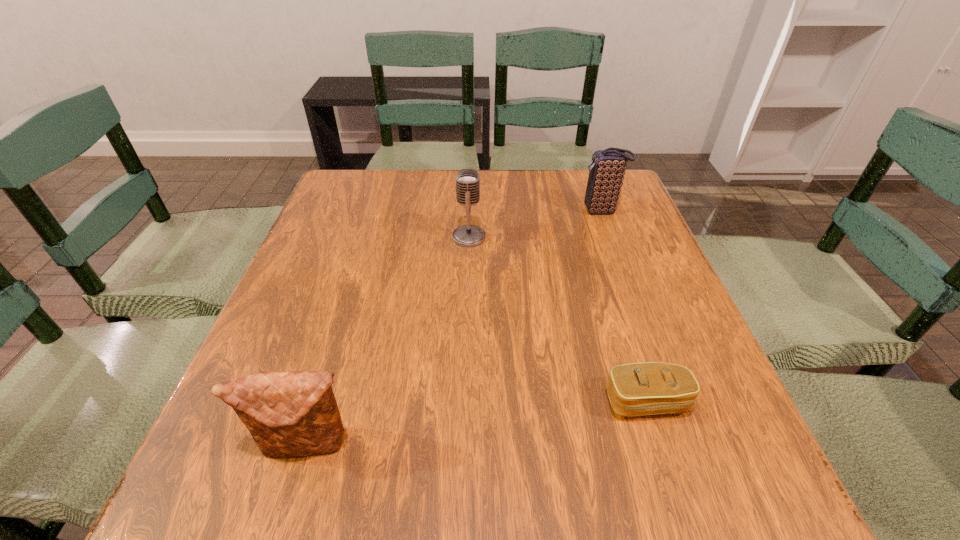
Find the location of a particular element. The width and height of the screenshot is (960, 540). free space located with the zip open on the farthest clutch bag is located at coordinates (502, 211).

Locate an element on the screen. The width and height of the screenshot is (960, 540). vacant space situated 0.060m on the zipper side of the shortest clutch bag is located at coordinates (665, 458).

Locate an element on the screen. object that is positioned at the far edge is located at coordinates (606, 174).

This screenshot has width=960, height=540. I want to click on object that is at the near edge, so click(x=289, y=413).

Locate an element on the screen. The height and width of the screenshot is (540, 960). object situated at the left edge is located at coordinates (289, 413).

Identify the location of object located in the near left corner section of the desktop. coord(289,413).

Identify the location of object present at the far right corner. click(606, 174).

This screenshot has height=540, width=960. Find the location of `vacant space at the far edge of the desktop`. vacant space at the far edge of the desktop is located at coordinates (512, 184).

You are a GUI agent. You are given a task and a screenshot of the screen. Output one action in this format:
    pyautogui.click(x=<x>, y=<y>)
    Task: Click on the free space at the left edge of the desktop
    
    Given the screenshot: What is the action you would take?
    pyautogui.click(x=340, y=314)

At what (x,y) coordinates should I click in order to perform the action: click on vacant space at the right edge of the desktop. Please return your answer as a coordinate pair (x, y). Looking at the image, I should click on (636, 353).